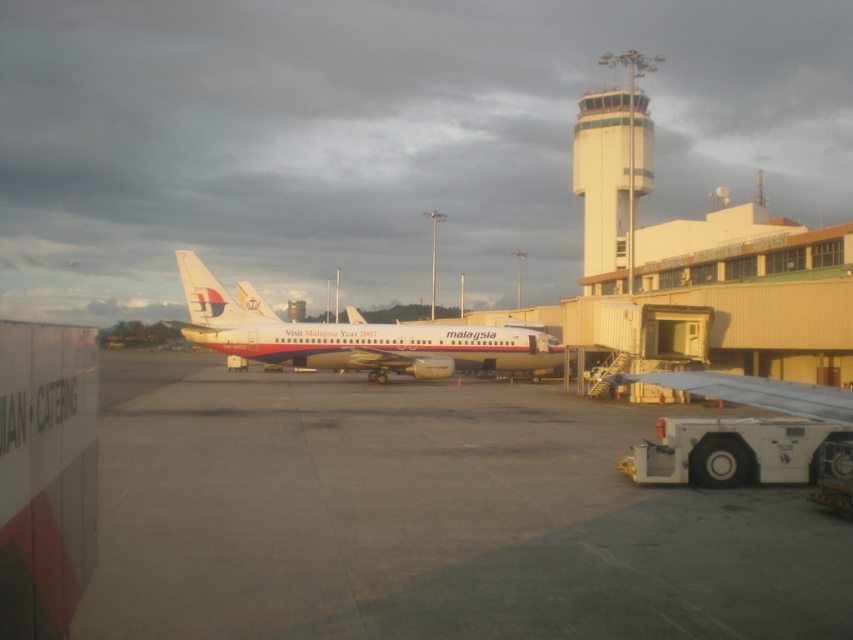
Is point (602, 442) positioned behind point (630, 250)?

No.

This screenshot has width=853, height=640. What are the coordinates of `gray concrete tarmac at center` in the screenshot? It's located at (427, 518).

In order to click on gray concrete tarmac at center in this screenshot , I will do `click(427, 518)`.

Does white glossy airplane at center appear on the right side of white concrete control tower at upper center?

Incorrect, white glossy airplane at center is not on the right side of white concrete control tower at upper center.

Identify the location of white glossy airplane at center. The height and width of the screenshot is (640, 853). (352, 339).

Is gray concrete tarmac at center closer to camera compared to white glossy airplane at center?

Yes, it is in front of white glossy airplane at center.

Find the location of `gray concrete tarmac at center`. gray concrete tarmac at center is located at coordinates (427, 518).